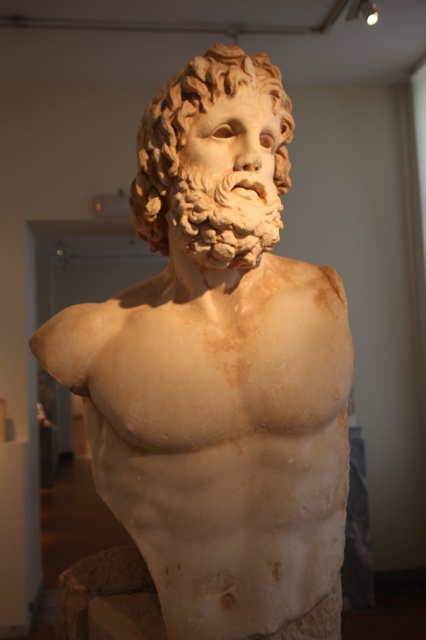
You are an art conservator standing at the center of the room. You need to place a protective barrier around the white marble bust at center. Given that the room is a square with coordinates from 0 to 1 on both axes, can you confirm if the bust is positioned within the central 0.2x0.2 meter area of the room?

The white marble bust at center is located at point (219, 371). The central 0.2x0.2 area would span from 0.4 to 0.6 on both axes. Since 0.581 and 0.516 are both within this range, the bust is indeed within the central area.

You are an art restorer working on a classical marble sculpture. You have two pieces in front of you, a white marble bust at center and a white marble head at center. Which piece has a larger size?

The white marble bust at center is bigger than the white marble head at center, so the white marble bust at center has a larger size.